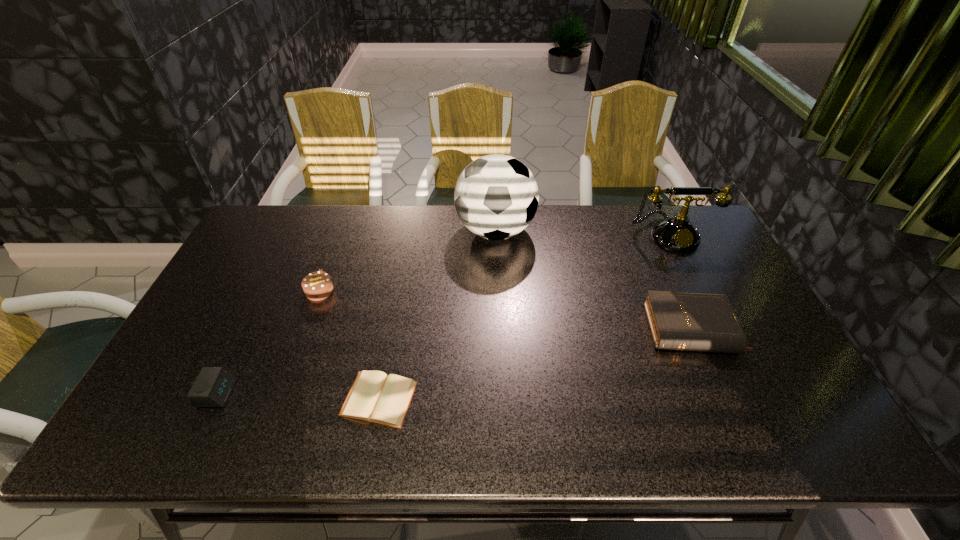
You are a GUI agent. You are given a task and a screenshot of the screen. Output one action in this format:
    pyautogui.click(x=<x>, y=<y>)
    Task: Click on the object that ranks as the fifth closest to the Bible
    
    Given the screenshot: What is the action you would take?
    pyautogui.click(x=213, y=385)

You are a GUI agent. You are given a task and a screenshot of the screen. Output one action in this format:
    pyautogui.click(x=<x>, y=<y>)
    Task: Click on the free space that satisfies the following two spatial constraints: 1. on the dial of the telephone; 2. on the front-facing side of the alarm clock
    The width and height of the screenshot is (960, 540).
    Given the screenshot: What is the action you would take?
    pyautogui.click(x=748, y=393)

I want to click on vacant position in the image that satisfies the following two spatial constraints: 1. on the dial of the telephone; 2. on the front-facing side of the leftmost object, so click(x=748, y=393).

What are the coordinates of `free space that satisfies the following two spatial constraints: 1. on the front-facing side of the fourth object from right to left; 2. on the left side of the alarm clock` in the screenshot? It's located at (215, 399).

Image resolution: width=960 pixels, height=540 pixels. Identify the location of free space that satisfies the following two spatial constraints: 1. on the back side of the diary; 2. on the right side of the Bible. (392, 329).

Locate an element on the screen. This screenshot has width=960, height=540. free location that satisfies the following two spatial constraints: 1. on the main logo of the soccer ball; 2. on the right side of the fourth farthest object is located at coordinates (499, 329).

Locate an element on the screen. This screenshot has width=960, height=540. vacant region that satisfies the following two spatial constraints: 1. on the front side of the fifth object from right to left; 2. on the front-facing side of the leftmost object is located at coordinates (282, 393).